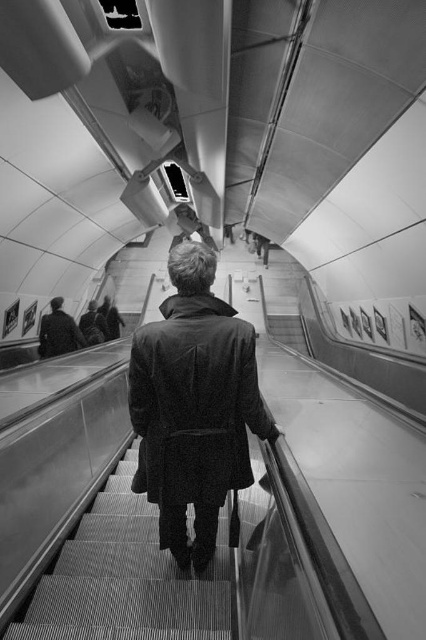
Based on the coordinates provided, where is the dark wool coat at center located in the image?

The dark wool coat at center is located at the 2D coordinates point (195, 404).

You are a fashion designer observing the scene. You need to create a new coat that will fit through the same space as the existing dark wool coat at center while also accommodating the width of the textured carpet stairs at center. What adjustment should you make to the coat design?

Since the dark wool coat at center is narrower than the textured carpet stairs at center, you should ensure the new coat maintains a width that is equal to or less than the current coat to fit through the same space while also being compatible with the stair width.

You are a fashion designer observing two coats in the subway station. The coats are the dark wool coat at center and the dark gray coat at upper center. Which one is positioned to the right side of the other?

The dark wool coat at center is positioned to the right of the dark gray coat at upper center.